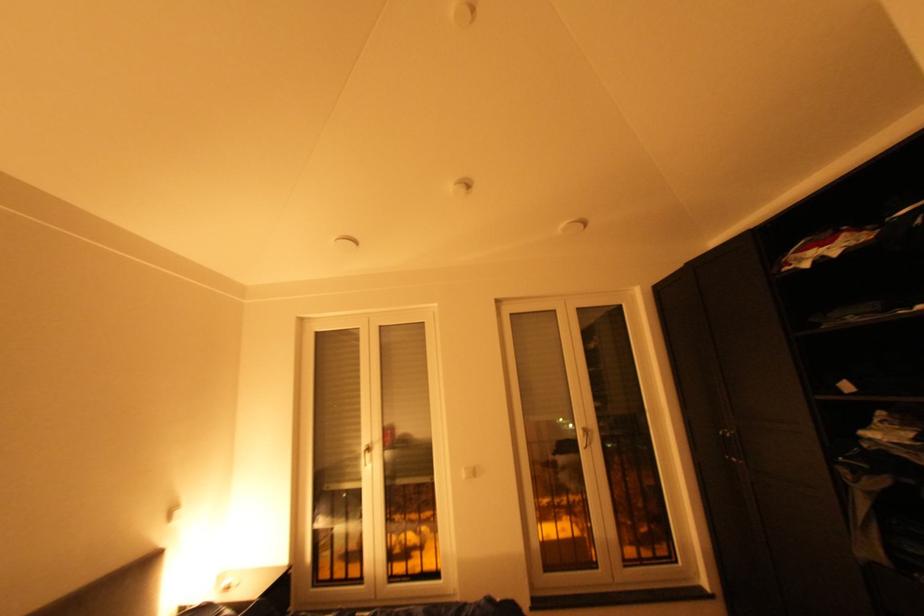
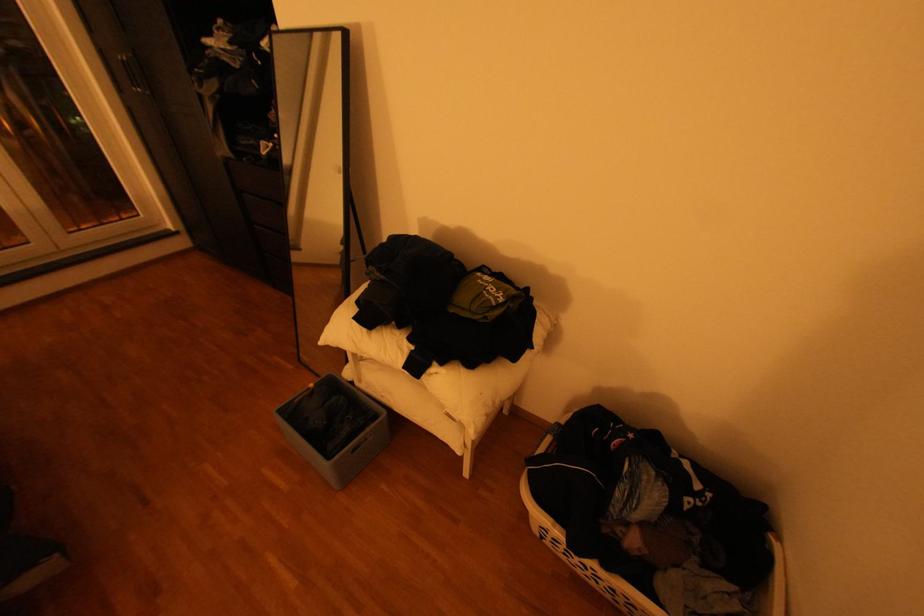
The images are taken continuously from a first-person perspective. In which direction is your viewpoint rotating?

The rotation direction of the camera is right-down.